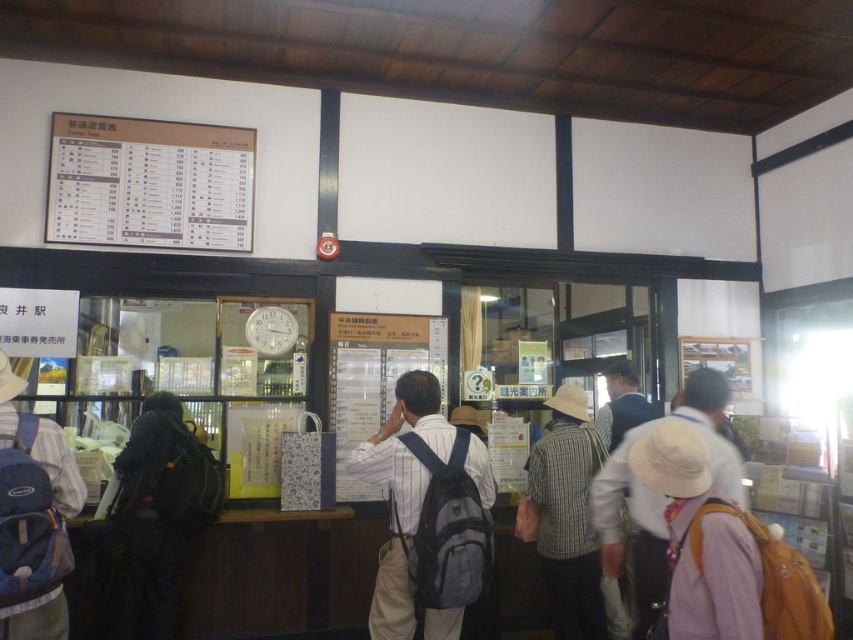
In the scene shown: Does matte paperboard at upper left come behind blue backpack at left?

Yes, matte paperboard at upper left is further from the viewer.

Can you confirm if matte paperboard at upper left is positioned above blue backpack at left?

Yes, matte paperboard at upper left is above blue backpack at left.

Image resolution: width=853 pixels, height=640 pixels. Find the location of `matte paperboard at upper left`. matte paperboard at upper left is located at coordinates (149, 182).

Can you confirm if matte paperboard at upper left is taller than dark blue backpack at left?

No, matte paperboard at upper left is not taller than dark blue backpack at left.

How far apart are matte paperboard at upper left and dark blue backpack at left?

matte paperboard at upper left and dark blue backpack at left are 1.23 meters apart.

The width and height of the screenshot is (853, 640). What do you see at coordinates (149, 182) in the screenshot?
I see `matte paperboard at upper left` at bounding box center [149, 182].

The image size is (853, 640). What are the coordinates of `matte paperboard at upper left` in the screenshot? It's located at (149, 182).

Does plaid fabric shirt at center have a larger size compared to white fabric hat at center?

Actually, plaid fabric shirt at center might be smaller than white fabric hat at center.

Can you confirm if plaid fabric shirt at center is positioned above white fabric hat at center?

No.

Is point (587, 611) farther from camera compared to point (606, 556)?

Yes, it is behind point (606, 556).

Where is `plaid fabric shirt at center`? This screenshot has width=853, height=640. plaid fabric shirt at center is located at coordinates (566, 515).